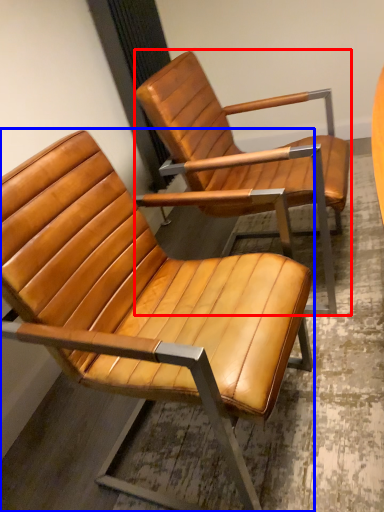
Question: Which point is further to the camera, chair (highlighted by a red box) or chair (highlighted by a blue box)?

Choices:
 (A) chair
 (B) chair

Answer: (A)